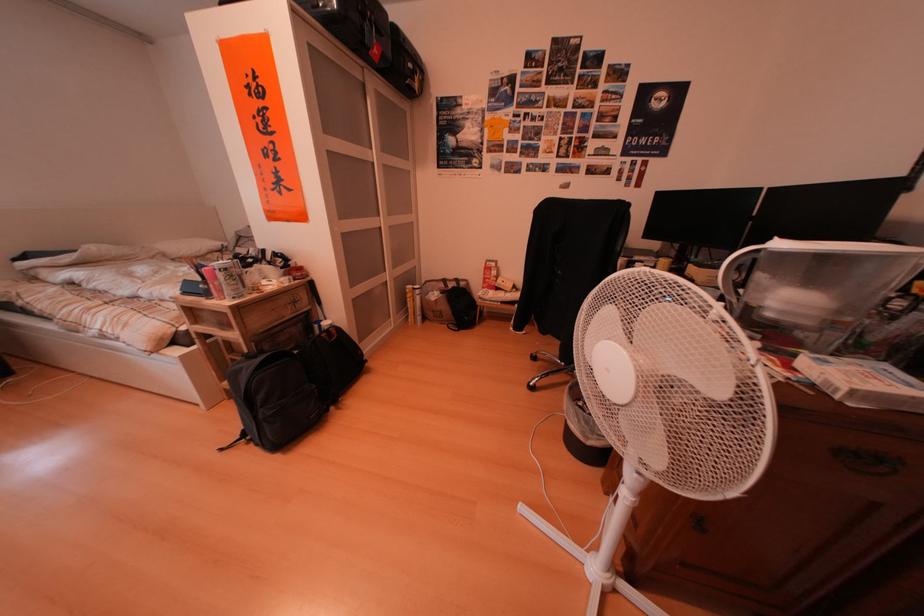
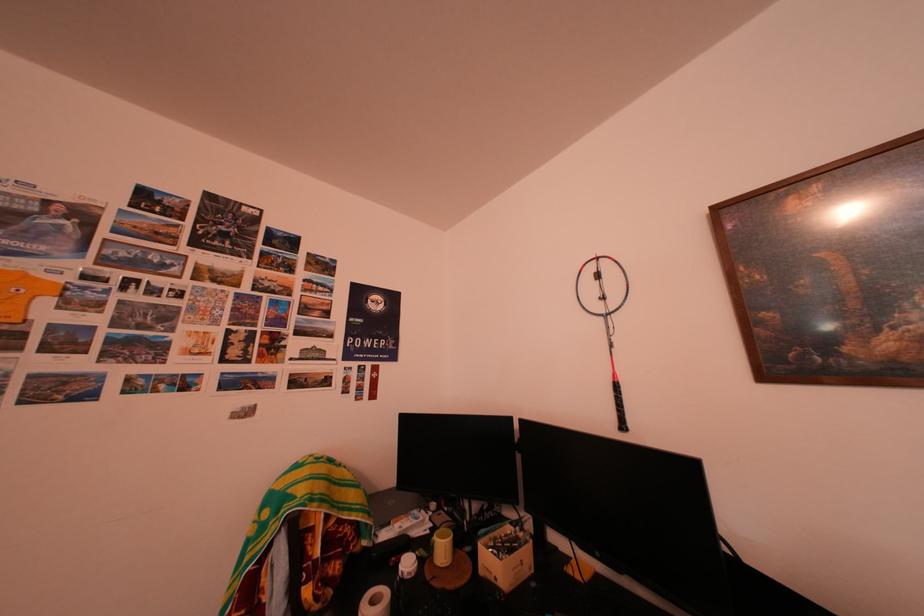
The point at [701,272] is marked in the first image. Where is the corresponding point in the second image?

(493, 552)